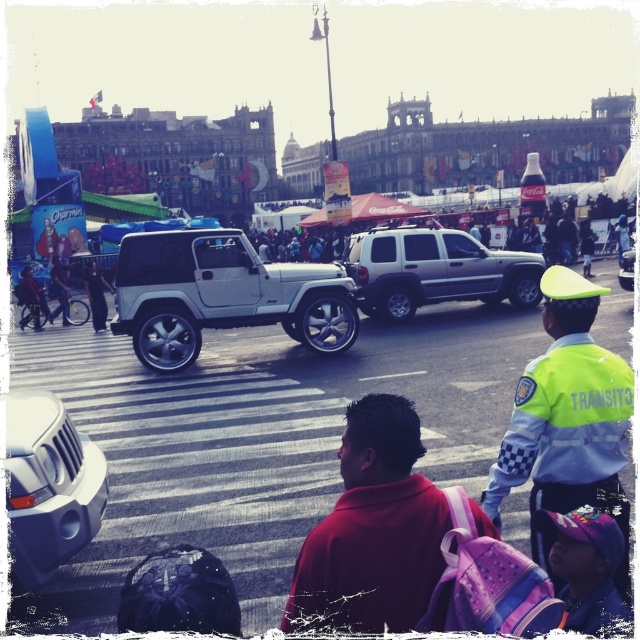
You are standing at the zebra crossing in the scene and want to take a photo. There are two points of interest marked as point 1 at coordinates (x=257, y=264) and point 2 at coordinates (x=99, y=276). Which point will appear larger in your photo?

Point 1 at coordinates (x=257, y=264) will appear larger in the photo because it is closer to the camera than point 2 at coordinates (x=99, y=276).

You are a pedestrian standing at the zebra crossing in the image. You notice two silver metallic vehicles parked at center. Which one is closer to the ground, the silver metallic jeep at center or the silver metallic car at center?

The silver metallic jeep at center is located below the silver metallic car at center, so the silver metallic jeep at center is closer to the ground.